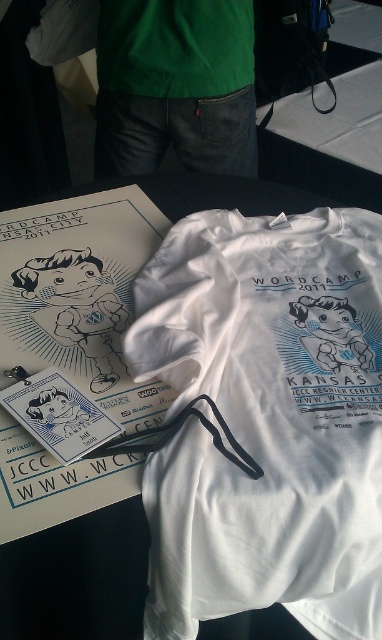
You are at the WordCamp Kansas City 2011 event and see a table with a green matte shirt at center and a matte plastic badge at center. Which item is positioned more to the left?

The green matte shirt at center is positioned more to the left than the matte plastic badge at center.